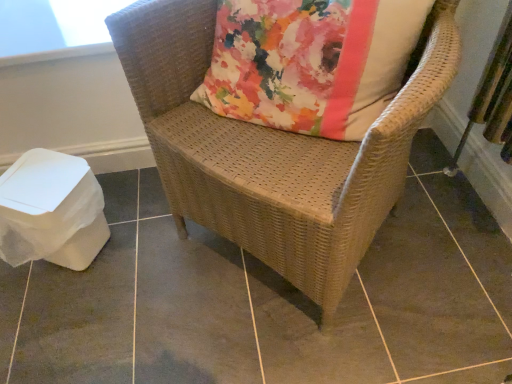
Image resolution: width=512 pixels, height=384 pixels. Describe the element at coordinates (265, 302) in the screenshot. I see `brown woven chair at center` at that location.

What do you see at coordinates (272, 151) in the screenshot? I see `woven wicker chair at center` at bounding box center [272, 151].

Where is `brown woven chair at center`? brown woven chair at center is located at coordinates (265, 302).

From a real-world perspective, is brown woven chair at center physically below woven wicker chair at center?

Yes, from a real-world perspective, brown woven chair at center is under woven wicker chair at center.

Are brown woven chair at center and woven wicker chair at center beside each other?

brown woven chair at center and woven wicker chair at center are not in contact.

Considering the relative sizes of brown woven chair at center and woven wicker chair at center in the image provided, is brown woven chair at center bigger than woven wicker chair at center?

Incorrect, brown woven chair at center is not larger than woven wicker chair at center.

Is brown woven chair at center to the left or to the right of woven wicker chair at center in the image?

In the image, brown woven chair at center appears on the left side of woven wicker chair at center.

From a real-world perspective, between woven wicker chair at center and brown woven chair at center, who is vertically higher?

In real-world perspective, woven wicker chair at center is above.

Are woven wicker chair at center and brown woven chair at center far apart?

No, woven wicker chair at center is not far away from brown woven chair at center.

Is woven wicker chair at center inside or outside of brown woven chair at center?

woven wicker chair at center lies outside brown woven chair at center.

From the picture: Is brown woven chair at center at the back of woven wicker chair at center?

No, woven wicker chair at center is not facing the opposite direction of brown woven chair at center.

Can you confirm if brown woven chair at center is shorter than transparent plastic window screen at upper left?

In fact, brown woven chair at center may be taller than transparent plastic window screen at upper left.

The image size is (512, 384). Identify the location of tile in front of the transparent plastic window screen at upper left. (265, 302).

What's the angular difference between brown woven chair at center and transparent plastic window screen at upper left's facing directions?

The facing directions of brown woven chair at center and transparent plastic window screen at upper left are 89.5 degrees apart.

Is brown woven chair at center to the left or to the right of transparent plastic window screen at upper left in the image?

brown woven chair at center is to the right of transparent plastic window screen at upper left.

Is transparent plastic window screen at upper left positioned beyond the bounds of woven wicker chair at center?

That's correct, transparent plastic window screen at upper left is outside of woven wicker chair at center.

From a real-world perspective, does transparent plastic window screen at upper left stand above woven wicker chair at center?

Yes, from a real-world perspective, transparent plastic window screen at upper left is over woven wicker chair at center

How far apart are transparent plastic window screen at upper left and woven wicker chair at center?

transparent plastic window screen at upper left and woven wicker chair at center are 23.73 inches apart from each other.

From the image's perspective, who appears lower, transparent plastic window screen at upper left or woven wicker chair at center?

woven wicker chair at center appears lower in the image.

Is transparent plastic window screen at upper left facing towards brown woven chair at center?

No, transparent plastic window screen at upper left is not turned towards brown woven chair at center.

Does transparent plastic window screen at upper left have a greater height compared to brown woven chair at center?

No.

Considering the positions of point (11, 54) and point (243, 288), is point (11, 54) closer or farther from the camera than point (243, 288)?

Point (11, 54).

Is woven wicker chair at center not near transparent plastic window screen at upper left?

That's not correct — woven wicker chair at center is a little close to transparent plastic window screen at upper left.

Is woven wicker chair at center shorter than transparent plastic window screen at upper left?

Incorrect, the height of woven wicker chair at center does not fall short of that of transparent plastic window screen at upper left.

Does woven wicker chair at center lie behind transparent plastic window screen at upper left?

No, it is in front of transparent plastic window screen at upper left.

In the scene shown: Is woven wicker chair at center facing towards transparent plastic window screen at upper left?

No, woven wicker chair at center does not turn towards transparent plastic window screen at upper left.

Image resolution: width=512 pixels, height=384 pixels. Identify the location of tile that appears on the left of woven wicker chair at center. (265, 302).

This screenshot has height=384, width=512. In order to click on chair on the right of brown woven chair at center in this screenshot , I will do `click(272, 151)`.

Estimate the real-world distances between objects in this image. Which object is further from woven wicker chair at center, brown woven chair at center or transparent plastic window screen at upper left?

transparent plastic window screen at upper left is positioned further to the anchor woven wicker chair at center.

Which object lies further to the anchor point transparent plastic window screen at upper left, brown woven chair at center or woven wicker chair at center?

The object further to transparent plastic window screen at upper left is brown woven chair at center.

From the image, which object appears to be farther from brown woven chair at center, woven wicker chair at center or transparent plastic window screen at upper left?

transparent plastic window screen at upper left lies further to brown woven chair at center than the other object.

Which object lies nearer to the anchor point brown woven chair at center, transparent plastic window screen at upper left or woven wicker chair at center?

The object closer to brown woven chair at center is woven wicker chair at center.

Considering their positions, is transparent plastic window screen at upper left positioned closer to woven wicker chair at center than brown woven chair at center?

Among the two, brown woven chair at center is located nearer to woven wicker chair at center.

Looking at the image, which one is located closer to transparent plastic window screen at upper left, woven wicker chair at center or brown woven chair at center?

Based on the image, woven wicker chair at center appears to be nearer to transparent plastic window screen at upper left.

At what (x,y) coordinates should I click in order to perform the action: click on tile located between transparent plastic window screen at upper left and woven wicker chair at center in the left-right direction. Please return your answer as a coordinate pair (x, y). Looking at the image, I should click on (265, 302).